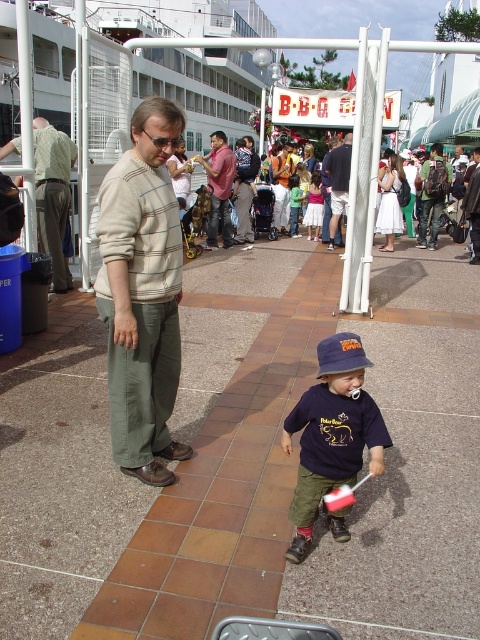
Is light beige striped sweater at center further to camera compared to matte pink shirt at center?

No, light beige striped sweater at center is closer to the viewer.

Looking at this image, does light beige striped sweater at center have a smaller size compared to matte pink shirt at center?

Indeed, light beige striped sweater at center has a smaller size compared to matte pink shirt at center.

Between point (136, 400) and point (223, 189), which one is positioned behind?

The point (223, 189) is behind.

What are the coordinates of `light beige striped sweater at center` in the screenshot? It's located at (143, 292).

Does brown tile pavement at center appear over green cotton shirt at center?

Incorrect, brown tile pavement at center is not positioned above green cotton shirt at center.

Does brown tile pavement at center appear on the left side of green cotton shirt at center?

Correct, you'll find brown tile pavement at center to the left of green cotton shirt at center.

The image size is (480, 640). Identify the location of brown tile pavement at center. (250, 460).

Who is more forward, (x=1, y=611) or (x=49, y=244)?

Point (x=1, y=611) is more forward.

Does brown tile pavement at center have a greater width compared to light green textured shirt at left?

Yes.

At what (x,y) coordinates should I click in order to perform the action: click on brown tile pavement at center. Please return your answer as a coordinate pair (x, y). This screenshot has height=640, width=480. Looking at the image, I should click on [250, 460].